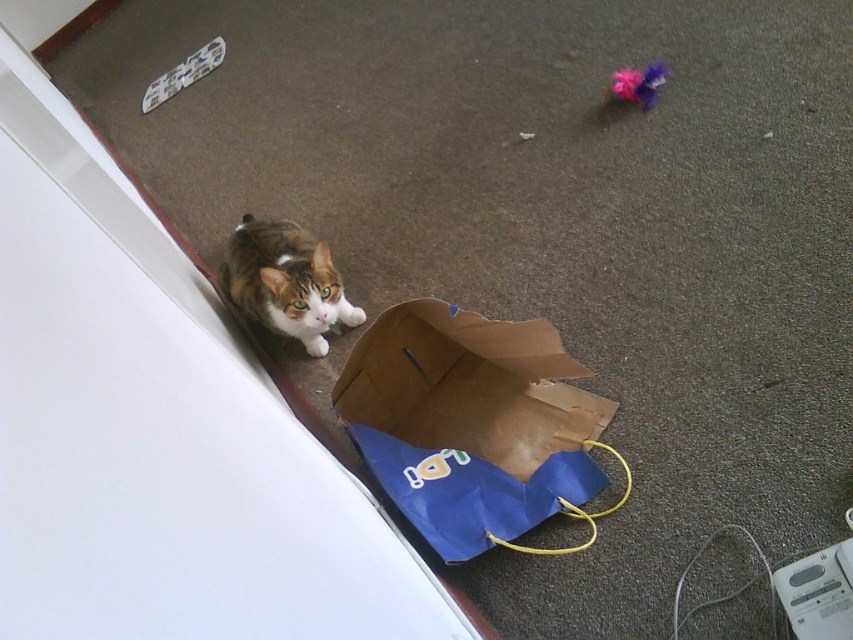
Question: Considering the real-world distances, which object is farthest from the tabby fur cat at center?

Choices:
 (A) brown paper bag at center
 (B) fuzzy fabric toy at upper right

Answer: (B)

Question: Which point is farther to the camera?

Choices:
 (A) tabby fur cat at center
 (B) fuzzy fabric toy at upper right
 (C) brown paper bag at center

Answer: (B)

Question: Does brown paper bag at center come in front of fuzzy fabric toy at upper right?

Choices:
 (A) no
 (B) yes

Answer: (B)

Question: Does brown paper bag at center have a smaller size compared to fuzzy fabric toy at upper right?

Choices:
 (A) yes
 (B) no

Answer: (B)

Question: Is brown paper bag at center to the right of tabby fur cat at center from the viewer's perspective?

Choices:
 (A) yes
 (B) no

Answer: (A)

Question: Which point appears closest to the camera in this image?

Choices:
 (A) (648, 68)
 (B) (389, 403)

Answer: (B)